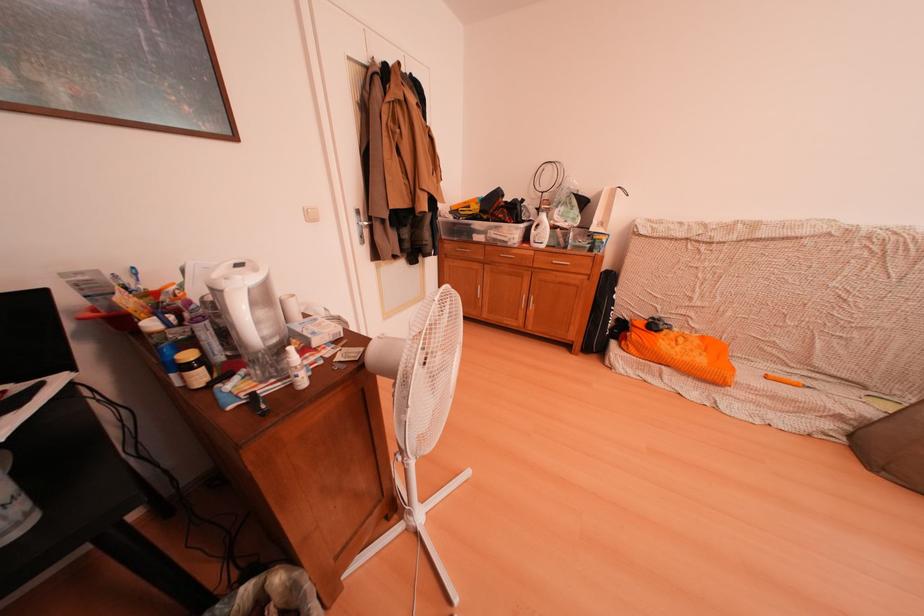
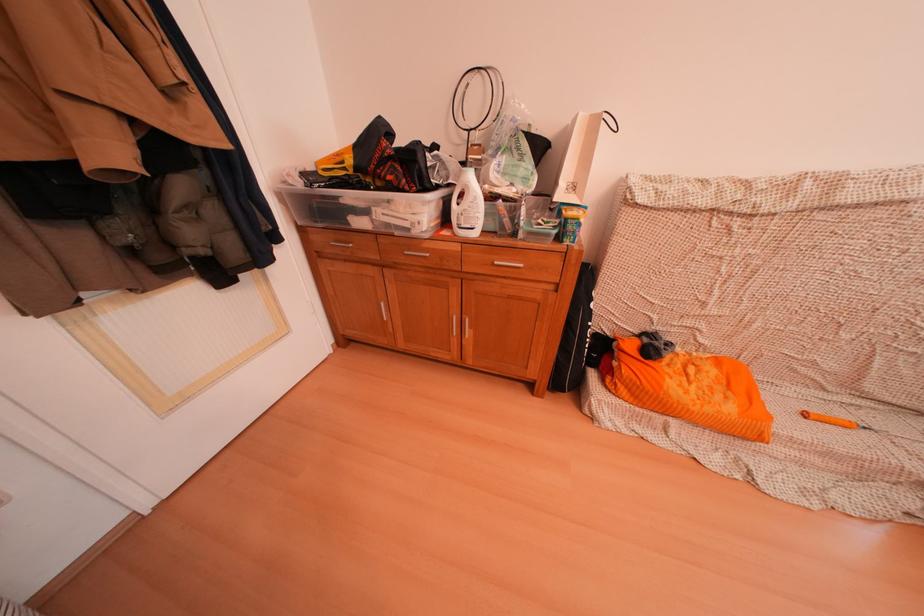
Find the pixel in the second image that matches the point at 784,379 in the first image.

(824, 415)